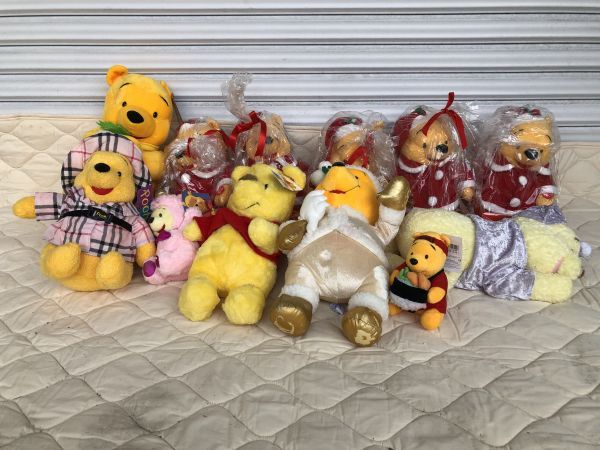
The width and height of the screenshot is (600, 450). I want to click on bottom row of pooh bear plushies, so click(x=122, y=222), click(x=165, y=247), click(x=231, y=252), click(x=368, y=269), click(x=411, y=283), click(x=475, y=259).